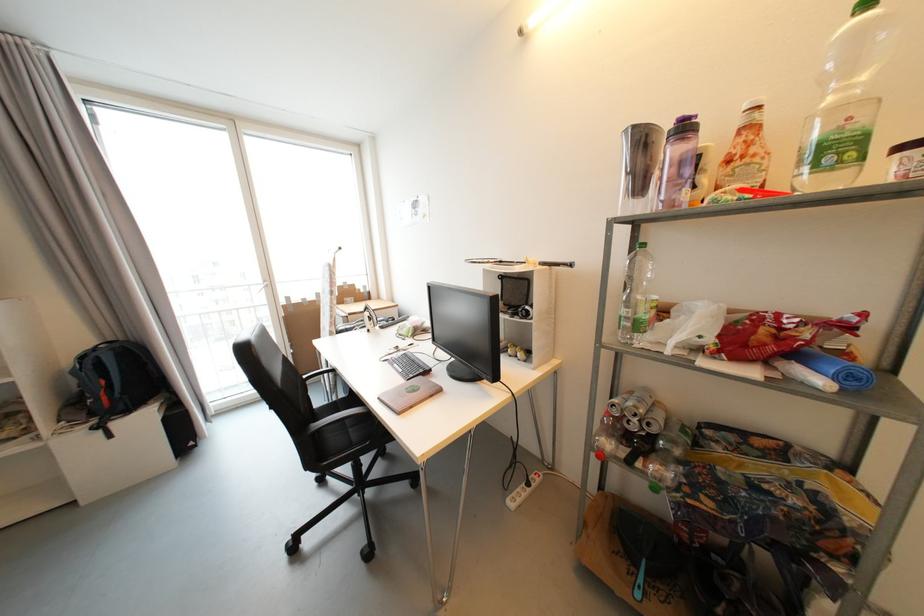
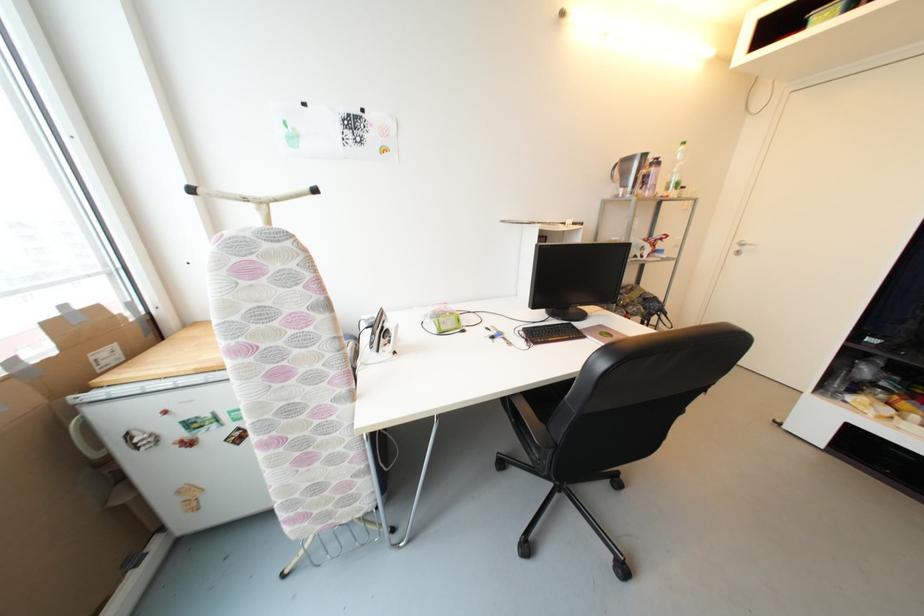
Find the pixel in the second image that matches (x=505, y=264) in the first image.

(540, 225)